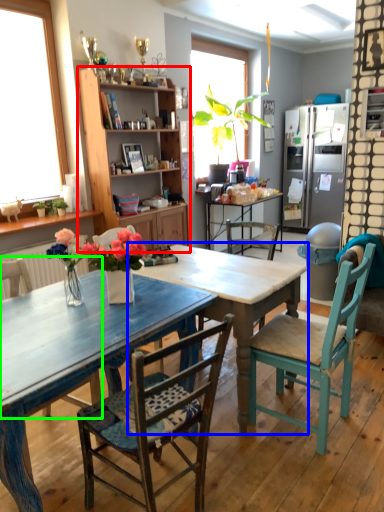
Question: Which object is positioned closest to cabinetry (highlighted by a red box)? Select from table (highlighted by a blue box) and chair (highlighted by a green box).

Choices:
 (A) table
 (B) chair

Answer: (A)